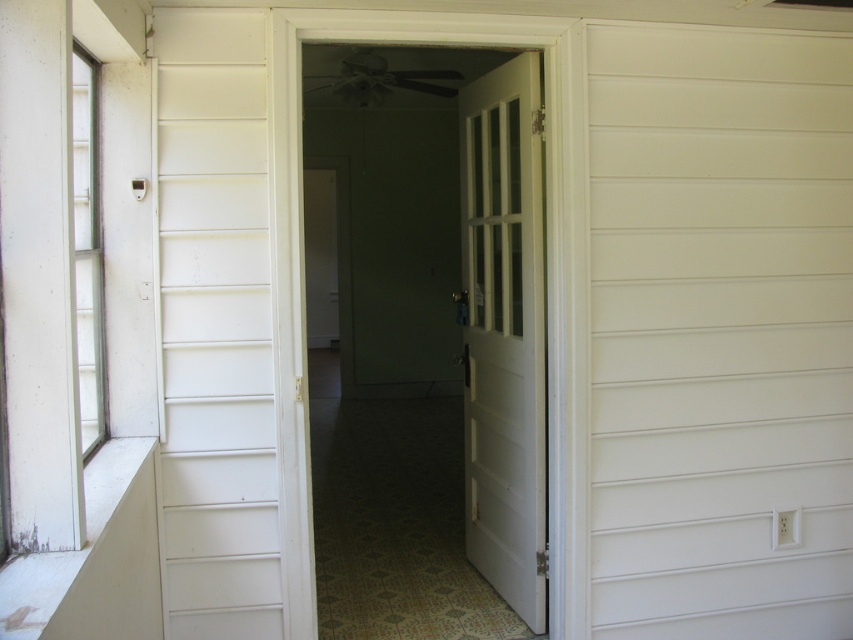
Can you confirm if white glossy door at center is smaller than clear glass window at left?

Yes, white glossy door at center is smaller than clear glass window at left.

Which is in front, point (425, 260) or point (96, 125)?

Point (96, 125) is more forward.

Is point (500, 70) less distant than point (97, 273)?

No.

Identify the location of white glossy door at center. (451, 273).

Between white glossy door at center and white wooden door at center, which one has less height?

Standing shorter between the two is white glossy door at center.

Does white glossy door at center appear on the right side of white wooden door at center?

No, white glossy door at center is not to the right of white wooden door at center.

Which is in front, point (416, 80) or point (480, 436)?

Point (480, 436) is in front.

Where is `white glossy door at center`? This screenshot has height=640, width=853. white glossy door at center is located at coordinates (451, 273).

Is white wooden door at center further to the viewer compared to clear glass window at left?

Yes, it is.

Describe the element at coordinates (503, 333) in the screenshot. I see `white wooden door at center` at that location.

Is point (480, 124) positioned in front of point (90, 140)?

No, it is not.

Identify the location of white wooden door at center. This screenshot has width=853, height=640. (503, 333).